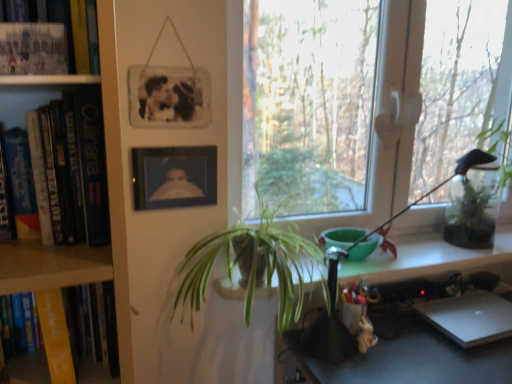
Question: Is matte paper book at upper left, the 1th book in the top-to-bottom sequence, shorter than silver metallic laptop at lower right?

Choices:
 (A) no
 (B) yes

Answer: (A)

Question: Considering the relative sizes of matte paper book at upper left, the 1th book in the top-to-bottom sequence, and silver metallic laptop at lower right in the image provided, is matte paper book at upper left, the 1th book in the top-to-bottom sequence, taller than silver metallic laptop at lower right?

Choices:
 (A) yes
 (B) no

Answer: (A)

Question: From the image's perspective, is matte paper book at upper left, the 1th book in the top-to-bottom sequence, on top of silver metallic laptop at lower right?

Choices:
 (A) yes
 (B) no

Answer: (A)

Question: Is matte paper book at upper left, the 1th book in the top-to-bottom sequence, thinner than silver metallic laptop at lower right?

Choices:
 (A) no
 (B) yes

Answer: (B)

Question: Does matte paper book at upper left, the 1th book in the top-to-bottom sequence, have a smaller size compared to silver metallic laptop at lower right?

Choices:
 (A) yes
 (B) no

Answer: (B)

Question: In terms of height, does matte black photo frame at upper left, acting as the third book starting from the bottom, look taller or shorter compared to silver metallic laptop at lower right?

Choices:
 (A) tall
 (B) short

Answer: (A)

Question: From the image's perspective, relative to silver metallic laptop at lower right, is matte black photo frame at upper left, acting as the third book starting from the bottom, above or below?

Choices:
 (A) above
 (B) below

Answer: (A)

Question: From a real-world perspective, is matte black photo frame at upper left, acting as the third book starting from the bottom, above or below silver metallic laptop at lower right?

Choices:
 (A) below
 (B) above

Answer: (B)

Question: Considering the positions of matte black photo frame at upper left, acting as the third book starting from the bottom, and silver metallic laptop at lower right in the image, is matte black photo frame at upper left, acting as the third book starting from the bottom, wider or thinner than silver metallic laptop at lower right?

Choices:
 (A) thin
 (B) wide

Answer: (A)

Question: From the image's perspective, relative to green leafy plant at right, arranged as the 1th houseplant when viewed from the right, is black matte picture frame at upper center, marked as the 2th picture frame in a bottom-to-top arrangement, above or below?

Choices:
 (A) below
 (B) above

Answer: (B)

Question: Based on their positions, is black matte picture frame at upper center, marked as the 2th picture frame in a bottom-to-top arrangement, located to the left or right of green leafy plant at right, the second houseplant from the front?

Choices:
 (A) left
 (B) right

Answer: (A)

Question: From a real-world perspective, is black matte picture frame at upper center, marked as the 2th picture frame in a bottom-to-top arrangement, positioned above or below green leafy plant at right, the second houseplant from the left?

Choices:
 (A) below
 (B) above

Answer: (B)

Question: Is black matte picture frame at upper center, which is the 1th picture frame in top-to-bottom order, wider or thinner than green leafy plant at right, arranged as the 1th houseplant when viewed from the right?

Choices:
 (A) wide
 (B) thin

Answer: (B)

Question: From their relative heights in the image, would you say matte black photo frame at upper left, which is counted as the second book, starting from the top, is taller or shorter than green leafy plant at right, arranged as the 1th houseplant when viewed from the right?

Choices:
 (A) tall
 (B) short

Answer: (B)

Question: Is matte black photo frame at upper left, which is counted as the second book, starting from the top, to the left or to the right of green leafy plant at right, the second houseplant from the left, in the image?

Choices:
 (A) left
 (B) right

Answer: (A)